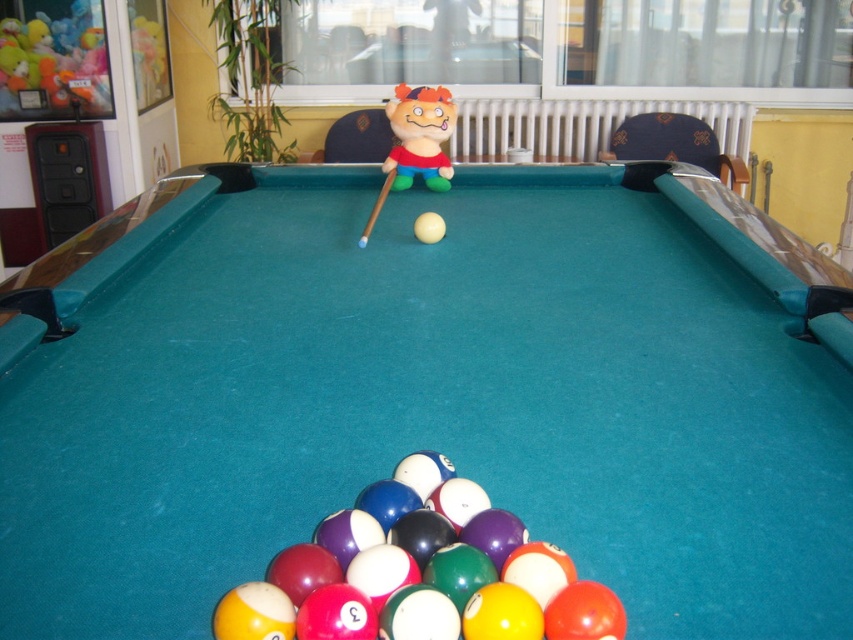
Question: Can you confirm if teal felt billiard table at center is wider than plush toy at center?

Choices:
 (A) yes
 (B) no

Answer: (A)

Question: Does teal felt billiard table at center appear on the left side of wooden at center?

Choices:
 (A) no
 (B) yes

Answer: (A)

Question: Estimate the real-world distances between objects in this image. Which object is closer to the plush toy at center?

Choices:
 (A) teal felt billiard table at center
 (B) wooden at center

Answer: (B)

Question: Based on their relative distances, which object is farther from the plush toy at center?

Choices:
 (A) teal felt billiard table at center
 (B) wooden at center

Answer: (A)

Question: Among these objects, which one is nearest to the camera?

Choices:
 (A) plush toy at center
 (B) teal felt billiard table at center
 (C) wooden at center

Answer: (B)

Question: Does teal felt billiard table at center lie in front of wooden at center?

Choices:
 (A) no
 (B) yes

Answer: (B)